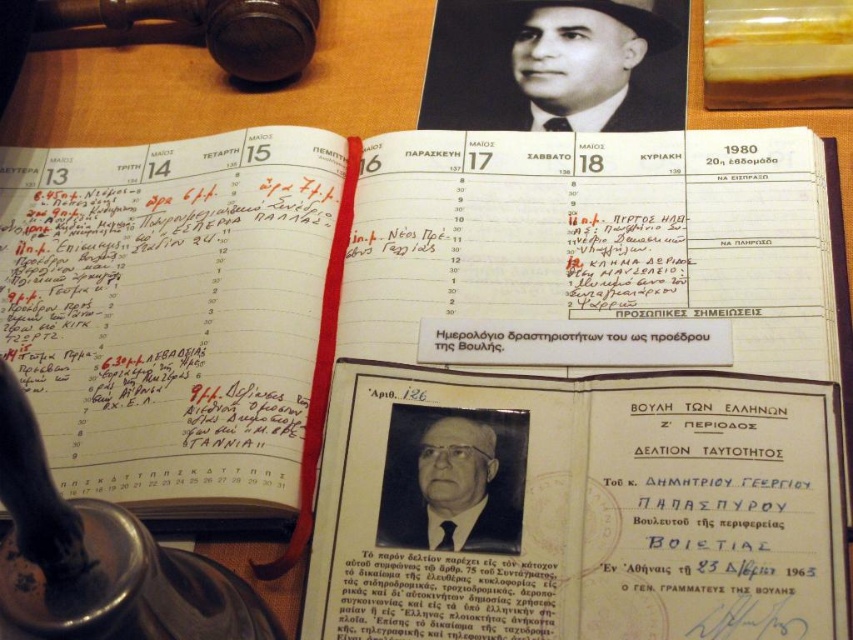
Question: Estimate the real-world distances between objects in this image. Which object is closer to the black glossy photo of man at center?

Choices:
 (A) smooth black hat at upper center
 (B) white paper document at center

Answer: (B)

Question: Can you confirm if white paper document at center is wider than black glossy photo of man at center?

Choices:
 (A) no
 (B) yes

Answer: (B)

Question: Which of these objects is positioned farthest from the white paper document at center?

Choices:
 (A) black glossy photo of man at center
 (B) smooth black hat at upper center

Answer: (B)

Question: Does smooth black hat at upper center appear on the left side of black glossy photo of man at center?

Choices:
 (A) yes
 (B) no

Answer: (B)

Question: Is smooth black hat at upper center closer to the viewer compared to black glossy photo of man at center?

Choices:
 (A) yes
 (B) no

Answer: (B)

Question: Among these objects, which one is nearest to the camera?

Choices:
 (A) smooth black hat at upper center
 (B) black glossy photo of man at center

Answer: (B)